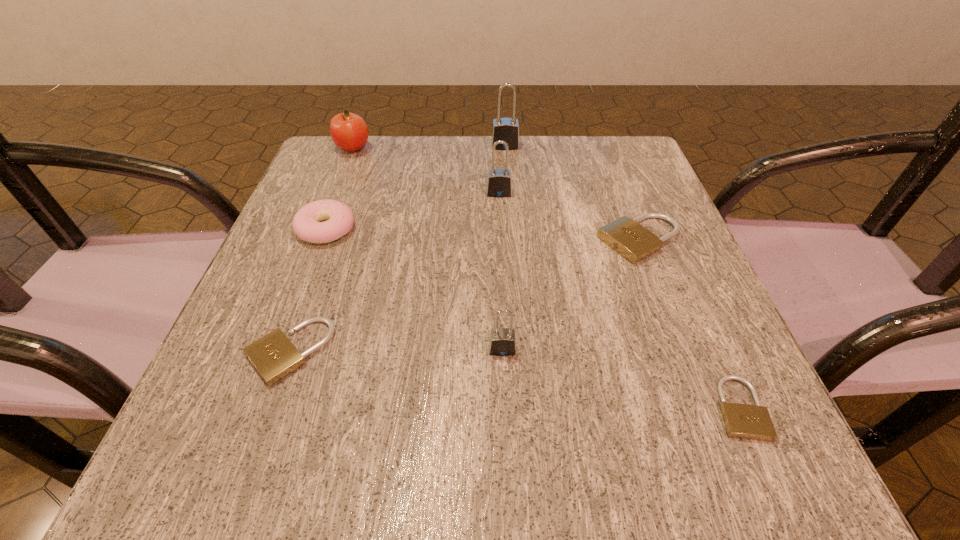
Choose which padlock is the nearest neighbor to the second smallest beige padlock. Please provide its 2D coordinates. Your answer should be formatted as a tuple, i.e. [(x, y)], where the tuple contains the x and y coordinates of a point satisfying the conditions above.

[(502, 342)]

The width and height of the screenshot is (960, 540). What are the coordinates of `the second closest gray padlock to the fifth shortest object` in the screenshot? It's located at (506, 129).

Select which gray padlock appears as the third closest to the third shortest padlock. Please provide its 2D coordinates. Your answer should be formatted as a tuple, i.e. [(x, y)], where the tuple contains the x and y coordinates of a point satisfying the conditions above.

[(506, 129)]

Identify which beige padlock is the third closest to the farthest padlock. Please provide its 2D coordinates. Your answer should be formatted as a tuple, i.e. [(x, y)], where the tuple contains the x and y coordinates of a point satisfying the conditions above.

[(744, 421)]

Point out which beige padlock is positioned as the nearest to the smallest beige padlock. Please provide its 2D coordinates. Your answer should be formatted as a tuple, i.e. [(x, y)], where the tuple contains the x and y coordinates of a point satisfying the conditions above.

[(626, 236)]

Locate an element on the screen. The image size is (960, 540). blank space that satisfies the following two spatial constraints: 1. on the shackle of the fifth shortest padlock; 2. on the left side of the shortest padlock is located at coordinates (510, 408).

The image size is (960, 540). What are the coordinates of `blank area in the image that satisfies the following two spatial constraints: 1. on the shackle of the shortest padlock; 2. on the left side of the fourth tallest object` in the screenshot? It's located at (505, 408).